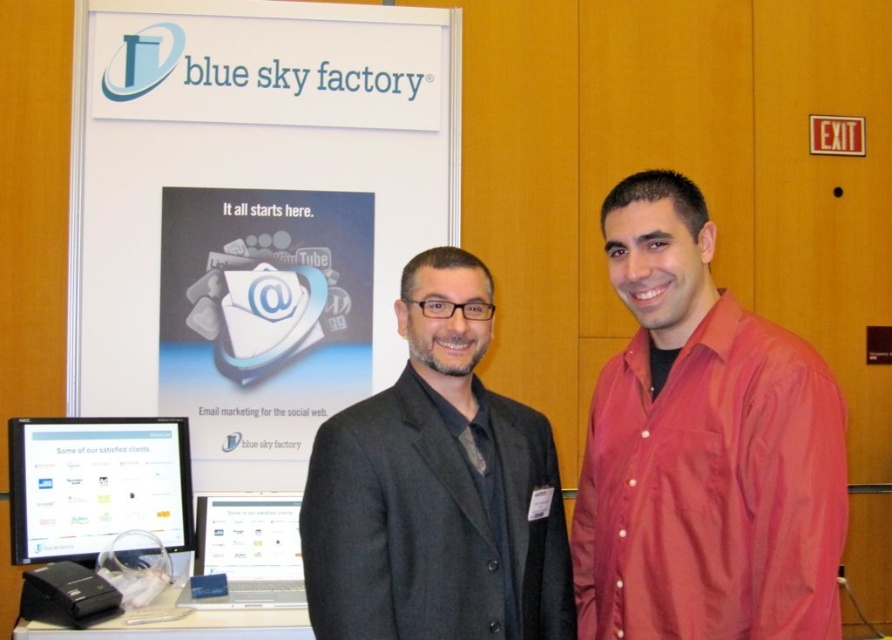
You are a photographer setting up for a group photo. You need to ensure that the red satin shirt at right and the matte black monitor at lower left are both visible in the frame. Given their sizes, which object should you prioritize positioning closer to the camera to maintain clarity in the photo?

The red satin shirt at right is larger than the matte black monitor at lower left, so you should prioritize positioning the matte black monitor at lower left closer to the camera to ensure it appears clear and well framed in the photo.

You are standing in front of the promotional display for Blue Sky Factory. You notice a red satin shirt at right and a matte black monitor at lower left. Which object is positioned more to the east if you consider the monitor faces north?

The red satin shirt at right is positioned more to the east because it is to the right of the matte black monitor at lower left, which faces north. Since the monitor faces north, its right side would be east.